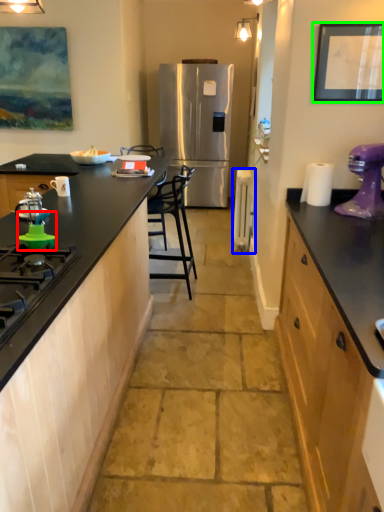
Question: Which object is positioned farthest from appliance (highlighted by a red box)? Select from appliance (highlighted by a blue box) and picture frame (highlighted by a green box).

Choices:
 (A) appliance
 (B) picture frame

Answer: (A)